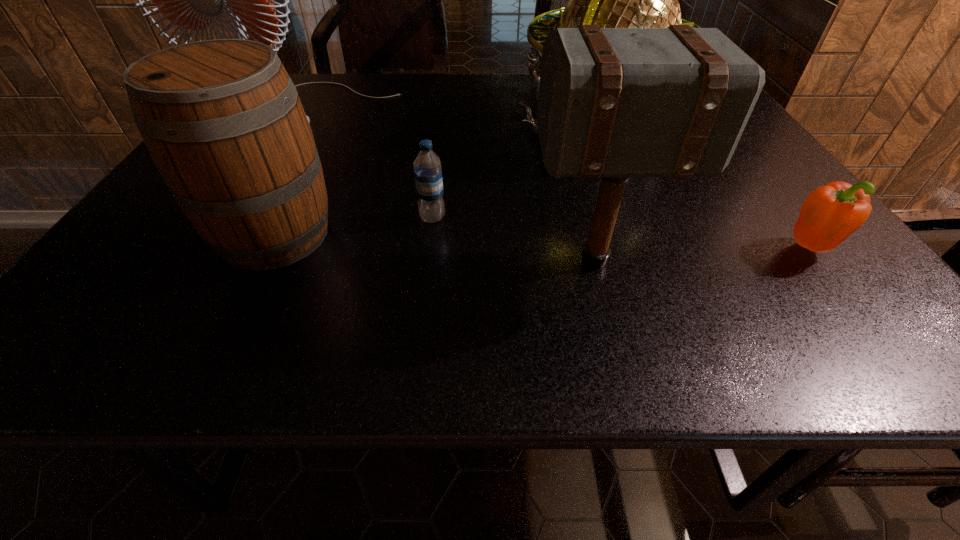
This screenshot has width=960, height=540. Find the location of `free space located 0.270m on the striking surface of the mallet`. free space located 0.270m on the striking surface of the mallet is located at coordinates (374, 261).

Image resolution: width=960 pixels, height=540 pixels. I want to click on free space located 0.090m on the front of the cider, so click(x=232, y=319).

Identify the location of vacant space positioned 0.070m on the label of the water bottle. (428, 250).

Find the location of a particular element. free space located 0.130m on the front of the rightmost object is located at coordinates 869,325.

This screenshot has height=540, width=960. I want to click on fan that is positioned at the far edge, so click(192, 0).

Where is `globe that is at the far edge`? The width and height of the screenshot is (960, 540). globe that is at the far edge is located at coordinates (613, 0).

Find the location of `fan at the left edge`. fan at the left edge is located at coordinates (192, 0).

Where is `cider at the left edge`? The height and width of the screenshot is (540, 960). cider at the left edge is located at coordinates (222, 120).

Identify the location of globe that is at the right edge. (613, 0).

You are a GUI agent. You are given a task and a screenshot of the screen. Output one action in this format:
    pyautogui.click(x=<x>, y=<y>)
    Task: Click on the pepper present at the right edge
    
    Given the screenshot: What is the action you would take?
    pyautogui.click(x=831, y=213)